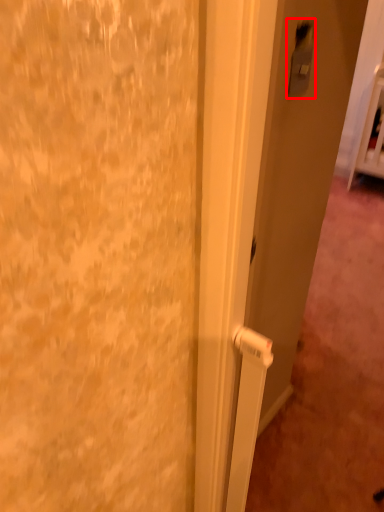
Question: Considering the relative positions of light switch (annotated by the red box) and door in the image provided, where is light switch (annotated by the red box) located with respect to the staircase?

Choices:
 (A) left
 (B) right

Answer: (A)